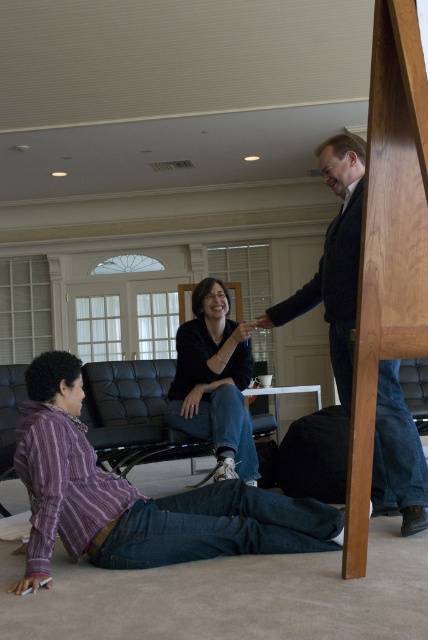
You are a delivery person who needs to place a small package between the purple striped shirt at lower left and the dark brown wood chair at right. Can you fit the package there?

The distance between the purple striped shirt at lower left and the dark brown wood chair at right is 3.61 feet, so yes, the package can be placed there as there is enough space between them.